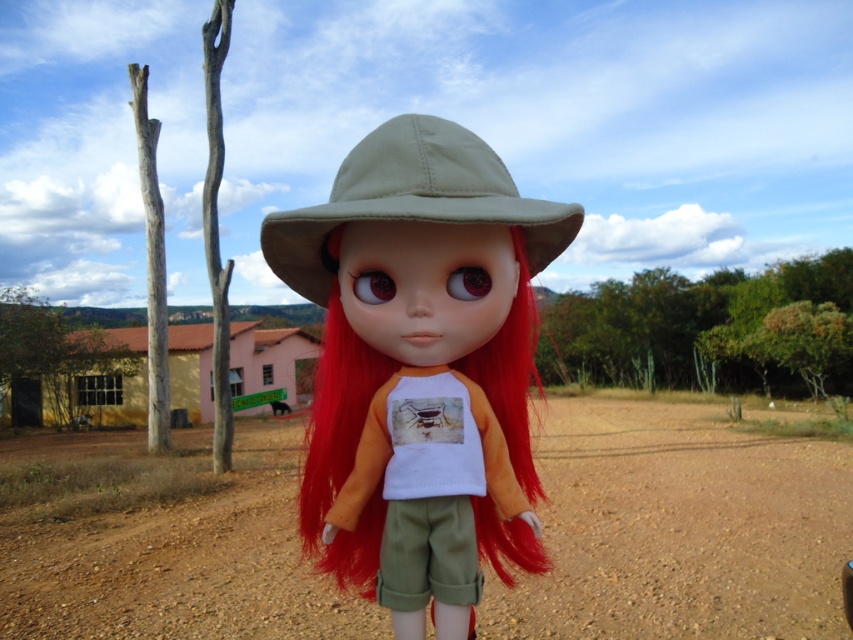
You are a photographer setting up a shot of the doll. You want to place a small prop between the brown sandy dirt at center and the khaki fabric hat at center. Where should you position it so it sits exactly halfway between them?

The prop should be placed halfway between the brown sandy dirt at center and the khaki fabric hat at center. Since the brown sandy dirt at center is to the right of the khaki fabric hat at center, the midpoint would be slightly to the right of the khaki fabric hat at center.